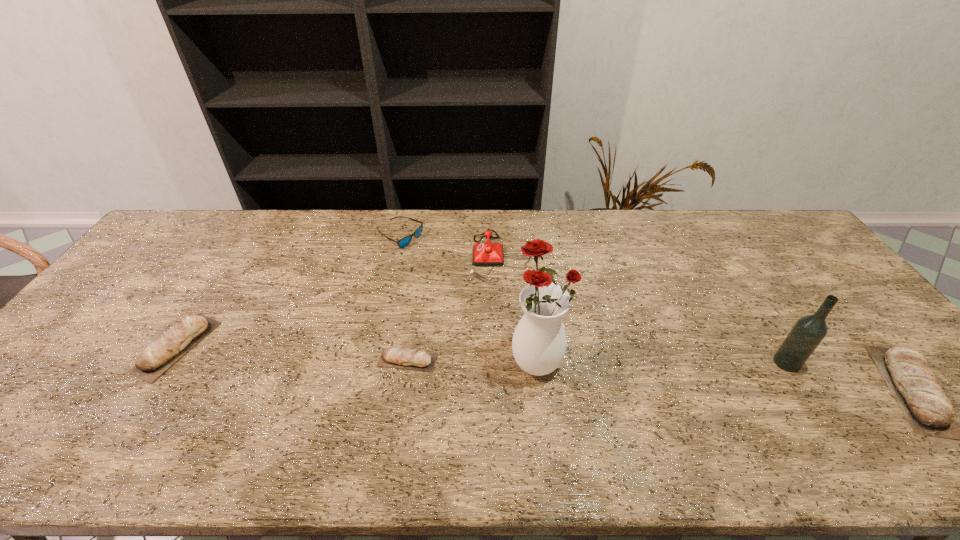
Find the location of a particular element. Image resolution: width=960 pixels, height=540 pixels. free spot between the vase and the sixth shortest object is located at coordinates (661, 361).

Locate an element on the screen. vacant area that lies between the sixth shortest object and the shortest object is located at coordinates (597, 361).

Locate which object ranks third in proximity to the second object from right to left. Please provide its 2D coordinates. Your answer should be formatted as a tuple, i.e. [(x, y)], where the tuple contains the x and y coordinates of a point satisfying the conditions above.

[(484, 254)]

Locate which object ranks fifth in proximity to the tallest object. Please provide its 2D coordinates. Your answer should be formatted as a tuple, i.e. [(x, y)], where the tuple contains the x and y coordinates of a point satisfying the conditions above.

[(929, 412)]

Where is `pita bread that is the closest to the rightmost pita bread`? pita bread that is the closest to the rightmost pita bread is located at coordinates (404, 358).

This screenshot has height=540, width=960. What are the coordinates of `the third closest pita bread to the sunglasses` in the screenshot? It's located at (929, 412).

Identify the location of blank area in the image that satisfies the following two spatial constraints: 1. on the back side of the vodka; 2. at the front of the sunglasses showing the lenses. The image size is (960, 540). (708, 238).

The width and height of the screenshot is (960, 540). I want to click on free spot that satisfies the following two spatial constraints: 1. at the front of the tallest object showing the lenses; 2. on the left side of the sunglasses, so (x=372, y=359).

Find the location of a particular element. The width and height of the screenshot is (960, 540). free spot that satisfies the following two spatial constraints: 1. at the front of the sunglasses showing the lenses; 2. on the back side of the tallest object is located at coordinates (372, 359).

Find the location of `vacant space that satisfies the following two spatial constraints: 1. on the front side of the shortest pita bread; 2. on the left side of the second object from right to left`. vacant space that satisfies the following two spatial constraints: 1. on the front side of the shortest pita bread; 2. on the left side of the second object from right to left is located at coordinates [407, 362].